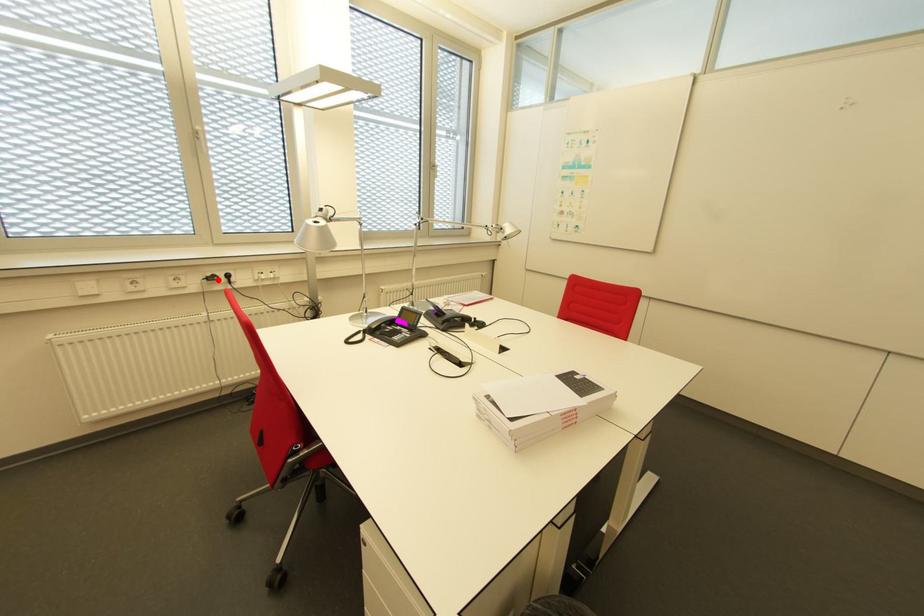
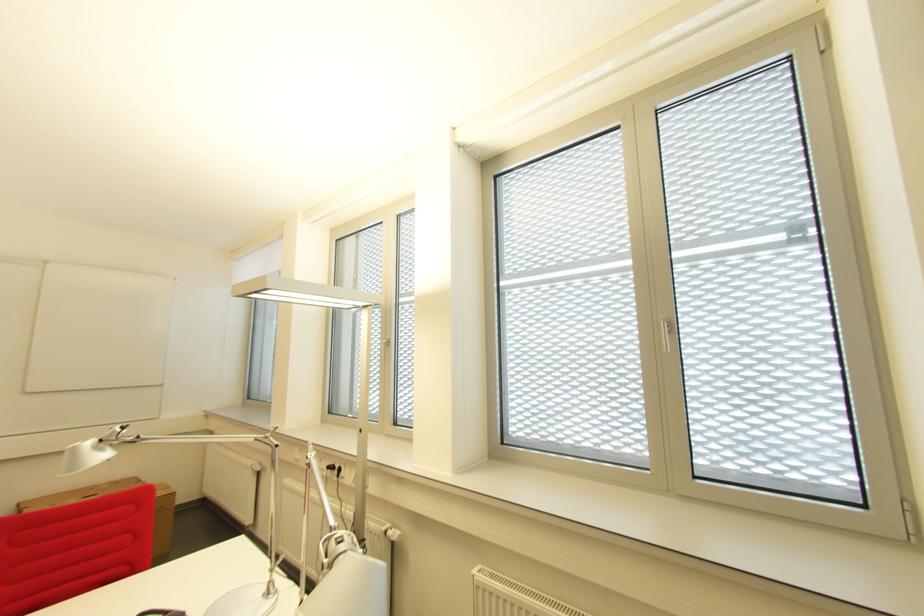
Locate, in the second image, the point that corresponds to the highlighted location in the first image.

(337, 469)